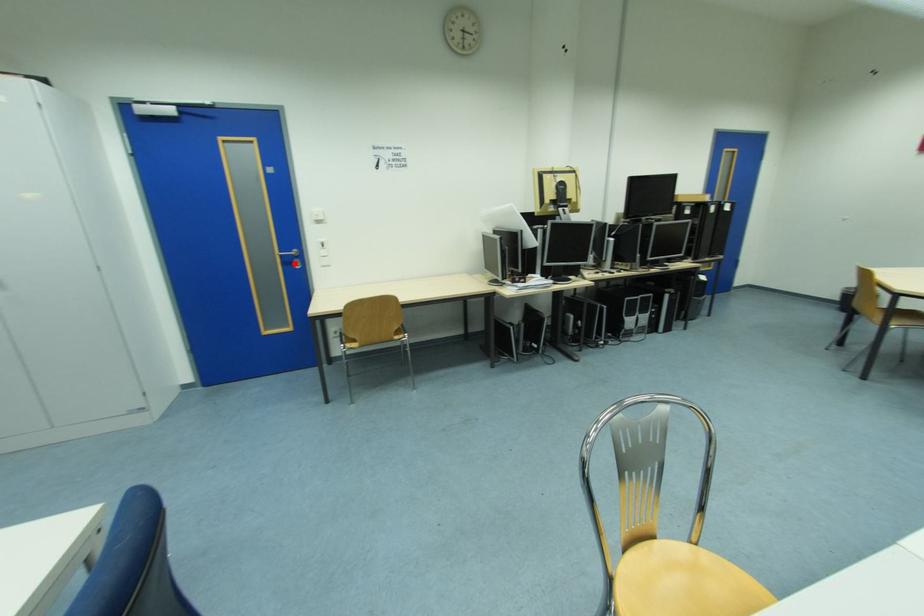
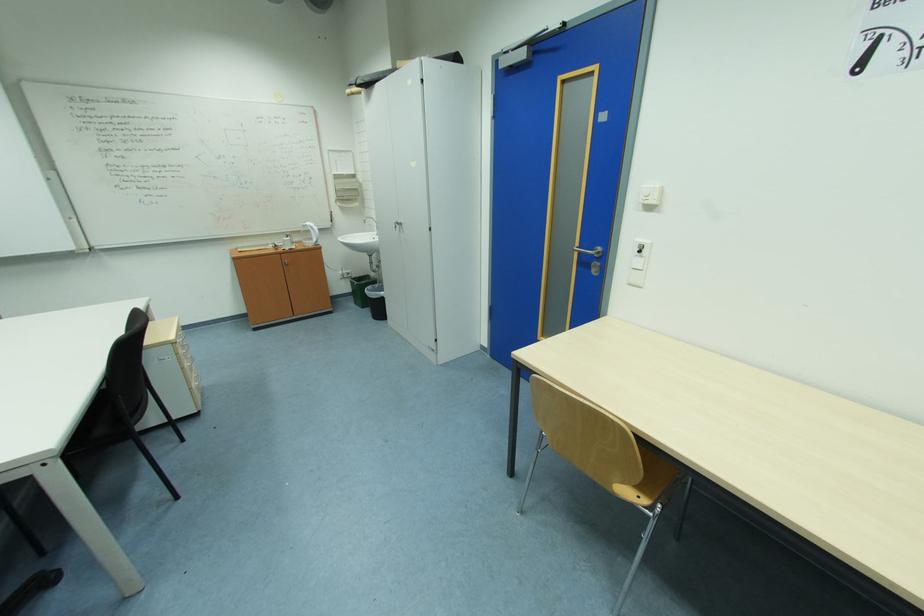
In the second image, find the point that corresponds to the highlighted location in the first image.

(590, 264)